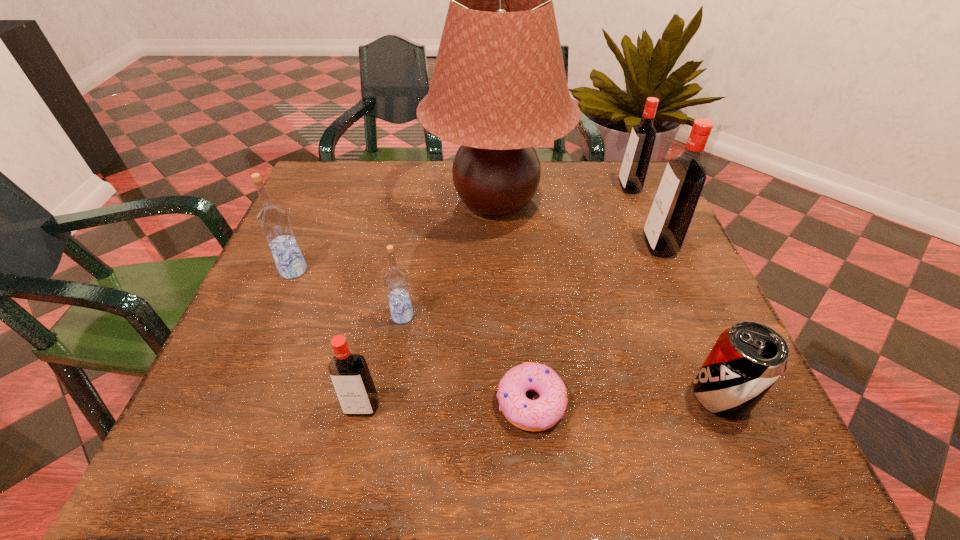
Where is `vodka present at the far edge`? The image size is (960, 540). vodka present at the far edge is located at coordinates (635, 164).

Find the location of `vodka that is at the near edge`. vodka that is at the near edge is located at coordinates (351, 378).

Find the location of a particular element. soda can present at the near edge is located at coordinates coord(747,359).

This screenshot has width=960, height=540. Find the location of `doughnut at the near edge`. doughnut at the near edge is located at coordinates (543, 413).

You are a GUI agent. You are given a task and a screenshot of the screen. Output one action in this format:
    pyautogui.click(x=<x>, y=<y>)
    Task: Click on the object present at the left edge
    
    Given the screenshot: What is the action you would take?
    pyautogui.click(x=274, y=222)

Find the location of a particular element. Image resolution: width=960 pixels, height=540 pixels. soda can at the right edge is located at coordinates (747, 359).

What are the coordinates of `object at the far right corner` in the screenshot? It's located at (635, 164).

The height and width of the screenshot is (540, 960). What are the coordinates of `object that is at the near right corner` in the screenshot? It's located at (747, 359).

This screenshot has width=960, height=540. Find the location of `free region at the far edge of the desktop`. free region at the far edge of the desktop is located at coordinates (446, 165).

Where is `vacant region at the near edge of the desktop`? vacant region at the near edge of the desktop is located at coordinates (424, 434).